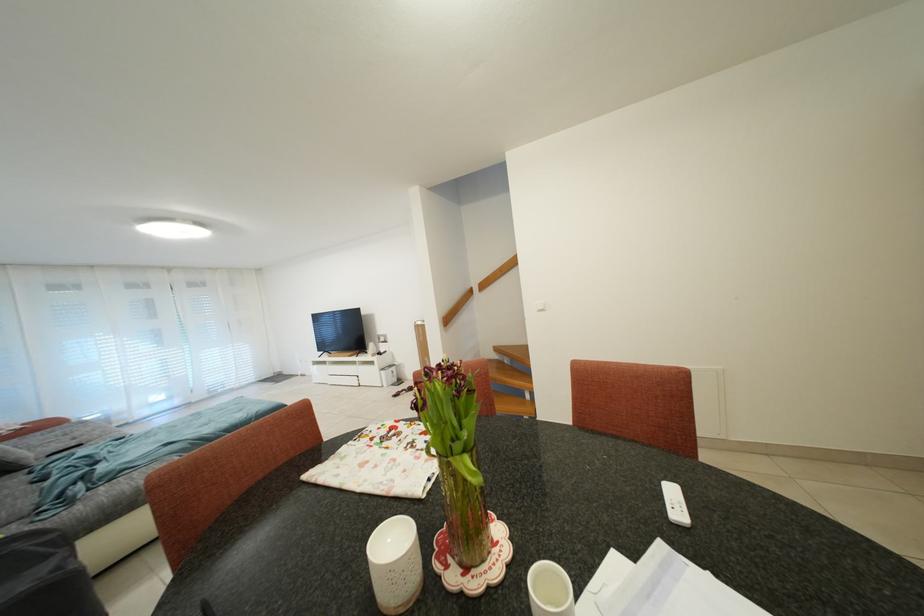
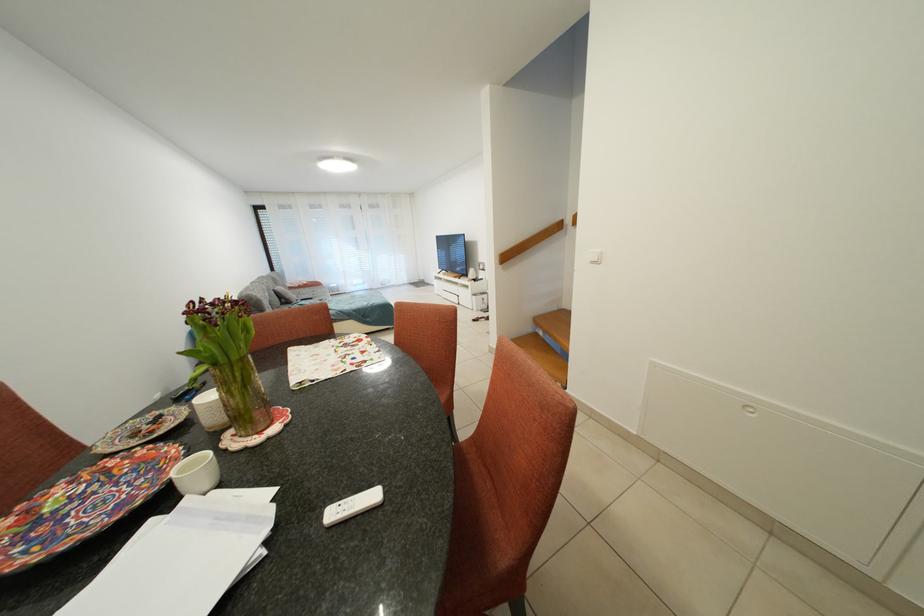
Locate, in the second image, the point that corresponds to the point at 472,455 in the first image.

(223, 369)